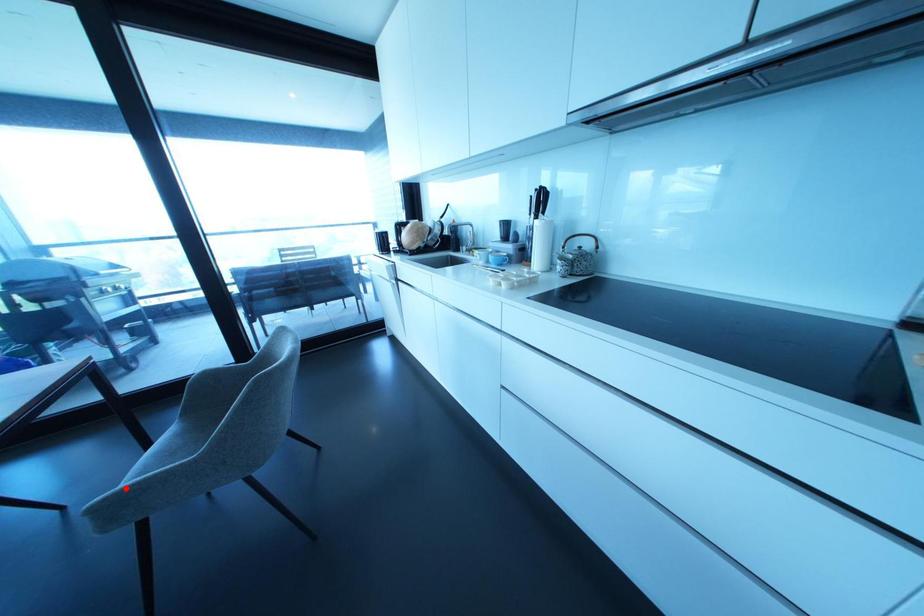
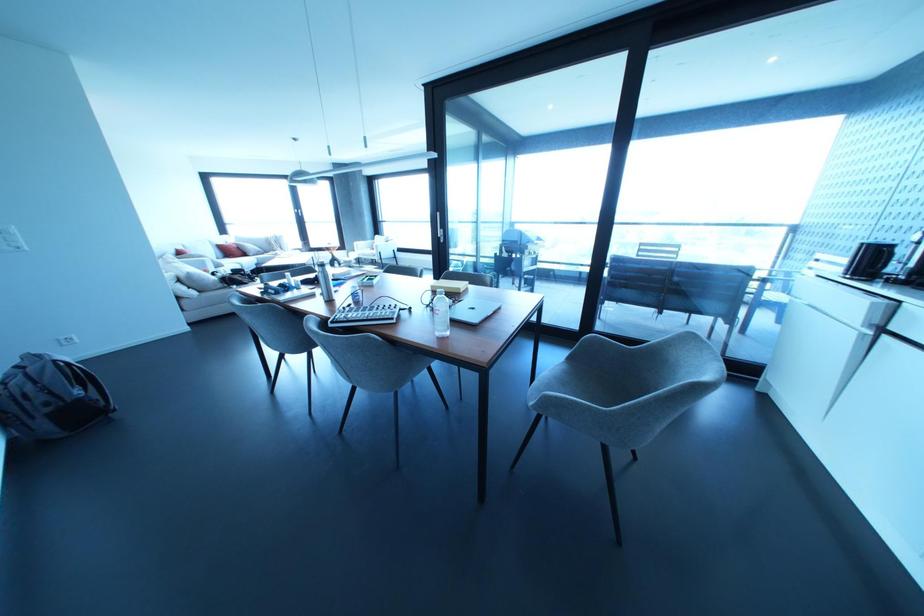
Find the pixel in the second image that matches the highlighted location in the first image.

(566, 399)